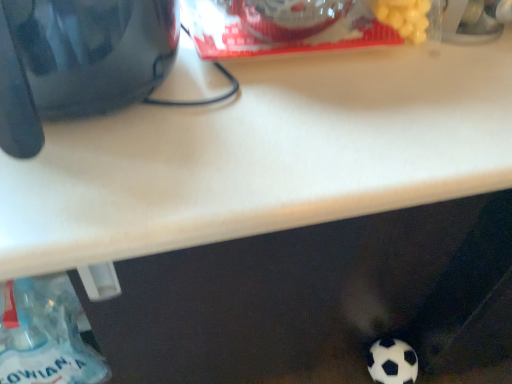
Question: Is translucent plastic bottle at lower left inside the boundaries of white matte football at lower right, or outside?

Choices:
 (A) outside
 (B) inside

Answer: (A)

Question: Considering the positions of translucent plastic bottle at lower left and white matte football at lower right in the image, is translucent plastic bottle at lower left taller or shorter than white matte football at lower right?

Choices:
 (A) short
 (B) tall

Answer: (B)

Question: Based on their relative distances, which object is nearer to the translucent plastic bottle at lower left?

Choices:
 (A) white matte football at lower right
 (B) glossy black kettle at upper left

Answer: (B)

Question: Which of these objects is positioned farthest from the glossy black kettle at upper left?

Choices:
 (A) white matte football at lower right
 (B) translucent plastic bottle at lower left

Answer: (A)